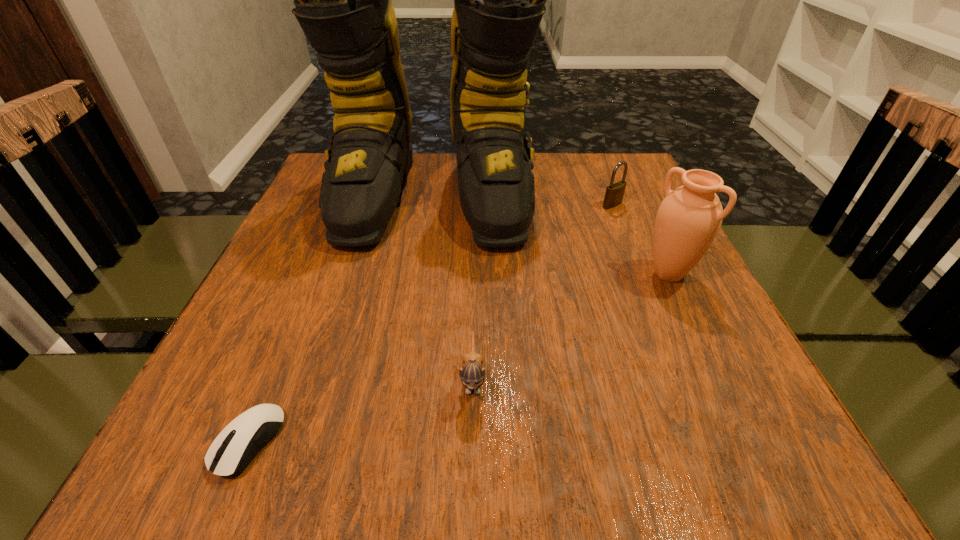
In order to click on free spot located 0.290m on the right of the mouse in this screenshot , I will do `click(488, 442)`.

Where is `object situated at the far edge`? Image resolution: width=960 pixels, height=540 pixels. object situated at the far edge is located at coordinates (343, 0).

You are a GUI agent. You are given a task and a screenshot of the screen. Output one action in this format:
    pyautogui.click(x=<x>, y=<y>)
    Task: Click on the object at the near edge
    
    Given the screenshot: What is the action you would take?
    pyautogui.click(x=234, y=448)

Where is `ski boots present at the left edge`? The image size is (960, 540). ski boots present at the left edge is located at coordinates (343, 0).

What are the coordinates of `mouse positioned at the left edge` in the screenshot? It's located at (234, 448).

The width and height of the screenshot is (960, 540). What are the coordinates of `urn situated at the right edge` in the screenshot? It's located at (688, 219).

You are a GUI agent. You are given a task and a screenshot of the screen. Output one action in this format:
    pyautogui.click(x=<x>, y=<y>)
    Task: Click on the padlock present at the right edge
    
    Given the screenshot: What is the action you would take?
    pyautogui.click(x=614, y=194)

Where is `object located in the far left corner section of the desktop`? The height and width of the screenshot is (540, 960). object located in the far left corner section of the desktop is located at coordinates (343, 0).

This screenshot has height=540, width=960. Find the location of `object at the near left corner`. object at the near left corner is located at coordinates (234, 448).

In the image, there is a desktop. Where is `blank space at the near edge`? The height and width of the screenshot is (540, 960). blank space at the near edge is located at coordinates (389, 456).